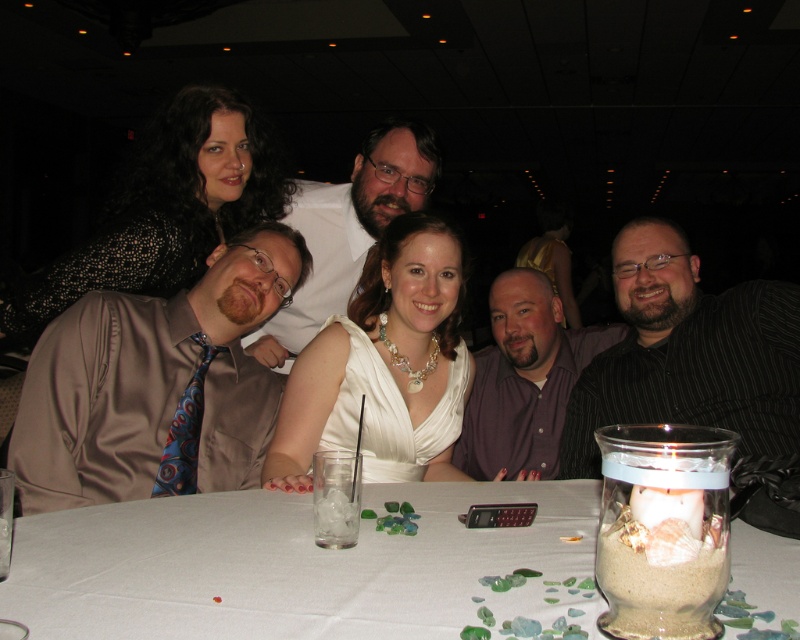
Question: Among these objects, which one is nearest to the camera?

Choices:
 (A) purple satin shirt at center
 (B) white satin dress at center
 (C) black striped shirt at right
 (D) matte white shirt at center

Answer: (B)

Question: Can you confirm if black striped shirt at right is positioned above purple satin shirt at center?

Choices:
 (A) yes
 (B) no

Answer: (A)

Question: Which point appears farthest from the camera in this image?

Choices:
 (A) (786, 372)
 (B) (156, 196)
 (C) (552, 348)

Answer: (C)

Question: Among these points, which one is farthest from the camera?

Choices:
 (A) (494, 301)
 (B) (140, 241)
 (C) (734, 454)

Answer: (A)

Question: Is white fabric table at center thinner than purple satin shirt at center?

Choices:
 (A) yes
 (B) no

Answer: (B)

Question: Is sparkly black dress at upper left below purple satin shirt at center?

Choices:
 (A) yes
 (B) no

Answer: (B)